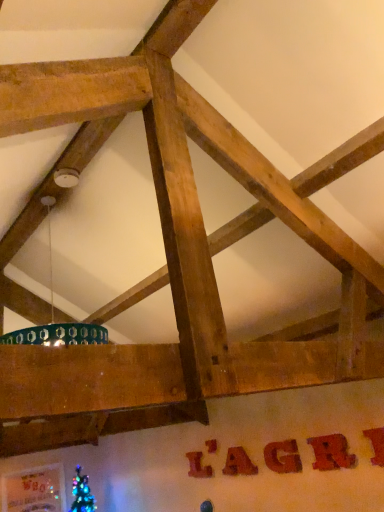
What is the approximate height of wooden sign at center, which appears as the first letter when viewed from the front?

It is 10.02 inches.

Identify the location of wooden sign at center, which is counted as the 1th letter, starting from the right. This screenshot has width=384, height=512. (376, 445).

This screenshot has height=512, width=384. What are the coordinates of `metallic gold letter at center, the 1th letter when ordered from back to front` in the screenshot? It's located at (211, 445).

Where is `wooden sign at center, arranged as the 5th letter when viewed from the back`? The height and width of the screenshot is (512, 384). wooden sign at center, arranged as the 5th letter when viewed from the back is located at coordinates (331, 452).

What do you see at coordinates (198, 465) in the screenshot? I see `brushed wood letter at center, the fifth letter from the front` at bounding box center [198, 465].

Image resolution: width=384 pixels, height=512 pixels. I want to click on wooden sign at center, positioned as the sixth letter in back-to-front order, so click(376, 445).

How many degrees apart are the facing directions of wooden sign at lower center, which is counted as the 4th letter, starting from the right, and brushed wood letter at center, positioned as the second letter in back-to-front order?

0.00922 degrees.

Considering the positions of objects wooden sign at lower center, the 3th letter viewed from the left, and brushed wood letter at center, the sixth letter when ordered from right to left, in the image provided, who is more to the left, wooden sign at lower center, the 3th letter viewed from the left, or brushed wood letter at center, the sixth letter when ordered from right to left,?

brushed wood letter at center, the sixth letter when ordered from right to left, is more to the left.

Which object is wider, wooden sign at lower center, which is the 3th letter from back to front, or brushed wood letter at center, the fifth letter from the front?

With larger width is wooden sign at lower center, which is the 3th letter from back to front.

Which object is more forward, matte brown letter at center, the third letter from the right, or brushed wood letter at center, the sixth letter when ordered from right to left?

matte brown letter at center, the third letter from the right.

Considering the relative sizes of matte brown letter at center, the 4th letter positioned from the left, and brushed wood letter at center, the sixth letter when ordered from right to left, in the image provided, is matte brown letter at center, the 4th letter positioned from the left, shorter than brushed wood letter at center, the sixth letter when ordered from right to left,?

Indeed, matte brown letter at center, the 4th letter positioned from the left, has a lesser height compared to brushed wood letter at center, the sixth letter when ordered from right to left.

Which point is more distant from viewer, (298, 453) or (188, 459)?

The point (188, 459) is farther from the camera.

Who is bigger, matte brown letter at center, the 4th letter positioned from the left, or brushed wood letter at center, the 1th letter in the left-to-right sequence?

matte brown letter at center, the 4th letter positioned from the left.

Considering the positions of objects matte brown letter at center, which appears as the 4th letter when viewed from the back, and wooden sign at center, marked as the 5th letter in a left-to-right arrangement, in the image provided, who is more to the left, matte brown letter at center, which appears as the 4th letter when viewed from the back, or wooden sign at center, marked as the 5th letter in a left-to-right arrangement,?

From the viewer's perspective, matte brown letter at center, which appears as the 4th letter when viewed from the back, appears more on the left side.

From a real-world perspective, which object rests below the other?

matte brown letter at center, the 3th letter viewed from the front, is physically lower.

From the image's perspective, is matte brown letter at center, the third letter from the right, positioned above or below wooden sign at center, arranged as the 5th letter when viewed from the back?

Based on their image positions, matte brown letter at center, the third letter from the right, is located beneath wooden sign at center, arranged as the 5th letter when viewed from the back.

From a real-world perspective, is wooden sign at lower center, which is counted as the 4th letter, starting from the right, physically above wooden sign at center, placed as the 2th letter when sorted from front to back?

No, from a real-world perspective, wooden sign at lower center, which is counted as the 4th letter, starting from the right, is not above wooden sign at center, placed as the 2th letter when sorted from front to back.

Do you think wooden sign at lower center, which is counted as the 4th letter, starting from the right, is within wooden sign at center, arranged as the 2th letter when viewed from the right, or outside of it?

wooden sign at lower center, which is counted as the 4th letter, starting from the right, cannot be found inside wooden sign at center, arranged as the 2th letter when viewed from the right.

Find the location of a particular element. The image size is (384, 512). the 2nd letter to the right of the wooden sign at lower center, which is counted as the 4th letter, starting from the right, starting your count from the anchor is located at coordinates click(331, 452).

In the scene shown: How many degrees apart are the facing directions of wooden sign at lower center, which ranks as the fourth letter in front-to-back order, and wooden sign at center, arranged as the 2th letter when viewed from the right?

They differ by 0.00992 degrees in their facing directions.

Would you say wooden sign at lower center, which is counted as the 4th letter, starting from the right, is to the left or to the right of metallic gold letter at center, the sixth letter positioned from the front, in the picture?

wooden sign at lower center, which is counted as the 4th letter, starting from the right, is to the right of metallic gold letter at center, the sixth letter positioned from the front.

Are wooden sign at lower center, which ranks as the fourth letter in front-to-back order, and metallic gold letter at center, the sixth letter positioned from the front, far apart?

wooden sign at lower center, which ranks as the fourth letter in front-to-back order, is near metallic gold letter at center, the sixth letter positioned from the front, not far away.

Is point (239, 473) more distant than point (205, 445)?

No.

Considering the sizes of objects wooden sign at lower center, which ranks as the fourth letter in front-to-back order, and metallic gold letter at center, which ranks as the fifth letter in right-to-left order, in the image provided, who is thinner, wooden sign at lower center, which ranks as the fourth letter in front-to-back order, or metallic gold letter at center, which ranks as the fifth letter in right-to-left order,?

metallic gold letter at center, which ranks as the fifth letter in right-to-left order.

Which letter is the 3rd one when counting from the left side of the wooden sign at center, which appears as the first letter when viewed from the front? Please provide its 2D coordinates.

[(238, 463)]

From a real-world perspective, which is physically below, wooden sign at center, which is counted as the 1th letter, starting from the right, or wooden sign at lower center, which is the 3th letter from back to front?

wooden sign at center, which is counted as the 1th letter, starting from the right.

Consider the image. Considering their positions, is wooden sign at center, which is counted as the 1th letter, starting from the right, located in front of or behind wooden sign at lower center, which is counted as the 4th letter, starting from the right?

Clearly, wooden sign at center, which is counted as the 1th letter, starting from the right, is in front of wooden sign at lower center, which is counted as the 4th letter, starting from the right.

In the scene shown: Considering the sizes of objects brushed wood letter at center, the 1th letter in the left-to-right sequence, and wooden sign at center, which is counted as the 1th letter, starting from the right, in the image provided, who is wider, brushed wood letter at center, the 1th letter in the left-to-right sequence, or wooden sign at center, which is counted as the 1th letter, starting from the right,?

wooden sign at center, which is counted as the 1th letter, starting from the right.

Between brushed wood letter at center, the sixth letter when ordered from right to left, and wooden sign at center, the 6th letter viewed from the left, which one appears on the right side from the viewer's perspective?

From the viewer's perspective, wooden sign at center, the 6th letter viewed from the left, appears more on the right side.

In the image, is brushed wood letter at center, the fifth letter from the front, positioned in front of or behind wooden sign at center, the 6th letter viewed from the left?

Visually, brushed wood letter at center, the fifth letter from the front, is located behind wooden sign at center, the 6th letter viewed from the left.

Does brushed wood letter at center, the fifth letter from the front, turn towards wooden sign at center, the 6th letter viewed from the left?

No, brushed wood letter at center, the fifth letter from the front, is not turned towards wooden sign at center, the 6th letter viewed from the left.

At what (x,y) coordinates should I click in order to perform the action: click on the 1st letter behind when counting from the wooden sign at lower center, which is counted as the 4th letter, starting from the right. Please return your answer as a coordinate pair (x, y). Looking at the image, I should click on click(198, 465).

From the matte brown letter at center, the 3th letter viewed from the front, count the 3rd letter to the left and point to it. Please provide its 2D coordinates.

[(198, 465)]

From the image, which object appears to be farther from wooden sign at center, which appears as the first letter when viewed from the front, matte brown letter at center, the third letter from the right, or brushed wood letter at center, positioned as the second letter in back-to-front order?

brushed wood letter at center, positioned as the second letter in back-to-front order, is further to wooden sign at center, which appears as the first letter when viewed from the front.

When comparing their distances from wooden sign at center, which is counted as the 1th letter, starting from the right, does wooden sign at lower center, which ranks as the fourth letter in front-to-back order, or wooden sign at center, arranged as the 2th letter when viewed from the right, seem further?

Based on the image, wooden sign at lower center, which ranks as the fourth letter in front-to-back order, appears to be further to wooden sign at center, which is counted as the 1th letter, starting from the right.

Estimate the real-world distances between objects in this image. Which object is further from wooden sign at lower center, the 3th letter viewed from the left, metallic gold letter at center, which ranks as the fifth letter in right-to-left order, or matte brown letter at center, the 4th letter positioned from the left?

matte brown letter at center, the 4th letter positioned from the left, lies further to wooden sign at lower center, the 3th letter viewed from the left, than the other object.

When comparing their distances from brushed wood letter at center, the fifth letter from the front, does matte brown letter at center, the third letter from the right, or wooden sign at lower center, which is the 3th letter from back to front, seem further?

matte brown letter at center, the third letter from the right.

From the image, which object appears to be farther from matte brown letter at center, the third letter from the right, brushed wood letter at center, the 1th letter in the left-to-right sequence, or wooden sign at center, positioned as the sixth letter in back-to-front order?

brushed wood letter at center, the 1th letter in the left-to-right sequence.

Estimate the real-world distances between objects in this image. Which object is closer to wooden sign at center, positioned as the sixth letter in back-to-front order, wooden sign at lower center, the 3th letter viewed from the left, or metallic gold letter at center, marked as the second letter in a left-to-right arrangement?

wooden sign at lower center, the 3th letter viewed from the left, is positioned closer to the anchor wooden sign at center, positioned as the sixth letter in back-to-front order.

From the picture: Which object lies nearer to the anchor point wooden sign at center, positioned as the sixth letter in back-to-front order, metallic gold letter at center, which ranks as the fifth letter in right-to-left order, or matte brown letter at center, the third letter from the right?

matte brown letter at center, the third letter from the right, is closer to wooden sign at center, positioned as the sixth letter in back-to-front order.

Which object lies nearer to the anchor point metallic gold letter at center, which ranks as the fifth letter in right-to-left order, brushed wood letter at center, the fifth letter from the front, or wooden sign at center, arranged as the 5th letter when viewed from the back?

brushed wood letter at center, the fifth letter from the front, is closer to metallic gold letter at center, which ranks as the fifth letter in right-to-left order.

Identify the location of letter between wooden sign at center, arranged as the 2th letter when viewed from the right, and wooden sign at lower center, which is counted as the 4th letter, starting from the right, along the z-axis. The height and width of the screenshot is (512, 384). (283, 457).

Where is `letter located between wooden sign at center, positioned as the sixth letter in back-to-front order, and matte brown letter at center, which appears as the 4th letter when viewed from the back, in the depth direction`? letter located between wooden sign at center, positioned as the sixth letter in back-to-front order, and matte brown letter at center, which appears as the 4th letter when viewed from the back, in the depth direction is located at coordinates (331, 452).

Image resolution: width=384 pixels, height=512 pixels. I want to click on letter between wooden sign at lower center, which is counted as the 4th letter, starting from the right, and metallic gold letter at center, marked as the second letter in a left-to-right arrangement, along the z-axis, so click(x=198, y=465).

Locate an element on the screen. letter positioned between matte brown letter at center, the 4th letter positioned from the left, and brushed wood letter at center, positioned as the second letter in back-to-front order, from near to far is located at coordinates (238, 463).